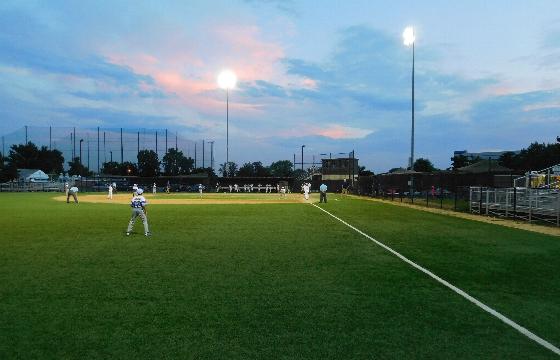
This screenshot has height=360, width=560. I want to click on lights, so click(227, 79), click(404, 36).